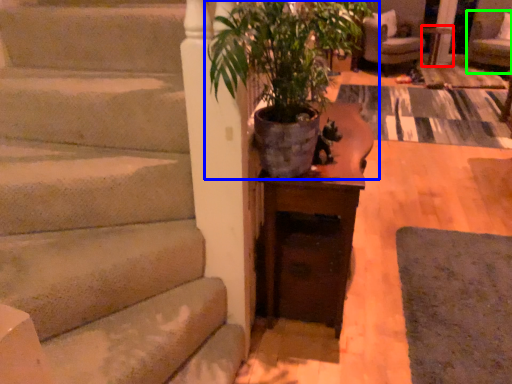
Question: Which object is the farthest from side table (highlighted by a red box)? Choose among these: houseplant (highlighted by a blue box) or armchair (highlighted by a green box).

Choices:
 (A) houseplant
 (B) armchair

Answer: (A)